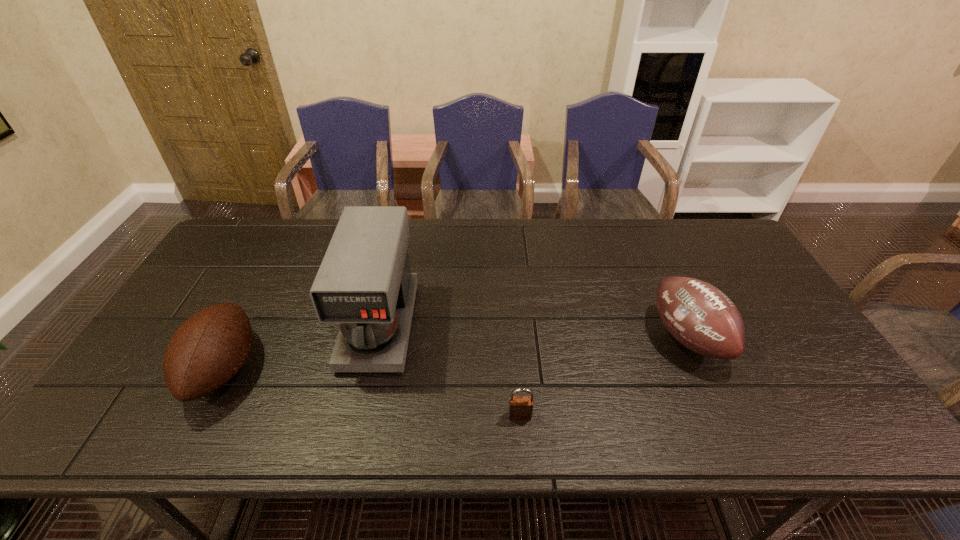
Find the location of `coffee maker`. coffee maker is located at coordinates (364, 282).

Find the location of a particular element. The width and height of the screenshot is (960, 540). the third object from right to left is located at coordinates (364, 282).

I want to click on the right football, so click(698, 315).

Image resolution: width=960 pixels, height=540 pixels. I want to click on the leftmost object, so click(210, 347).

Identify the location of padlock. (520, 407).

Find the location of a particular element. The width and height of the screenshot is (960, 540). the third object from left to right is located at coordinates (520, 407).

Image resolution: width=960 pixels, height=540 pixels. I want to click on vacant space located on the carafe side of the third object from right to left, so click(x=365, y=393).

You are a GUI agent. You are given a task and a screenshot of the screen. Output one action in this format:
    pyautogui.click(x=<x>, y=<y>)
    Task: Click on the blank space located 0.180m on the left of the rightmost object
    Image resolution: width=960 pixels, height=540 pixels.
    Given the screenshot: What is the action you would take?
    pyautogui.click(x=587, y=338)

This screenshot has width=960, height=540. What are the coordinates of `free space located on the laces of the leftmost object` in the screenshot? It's located at (365, 369).

Where is `football that is at the near edge`? The image size is (960, 540). football that is at the near edge is located at coordinates (210, 347).